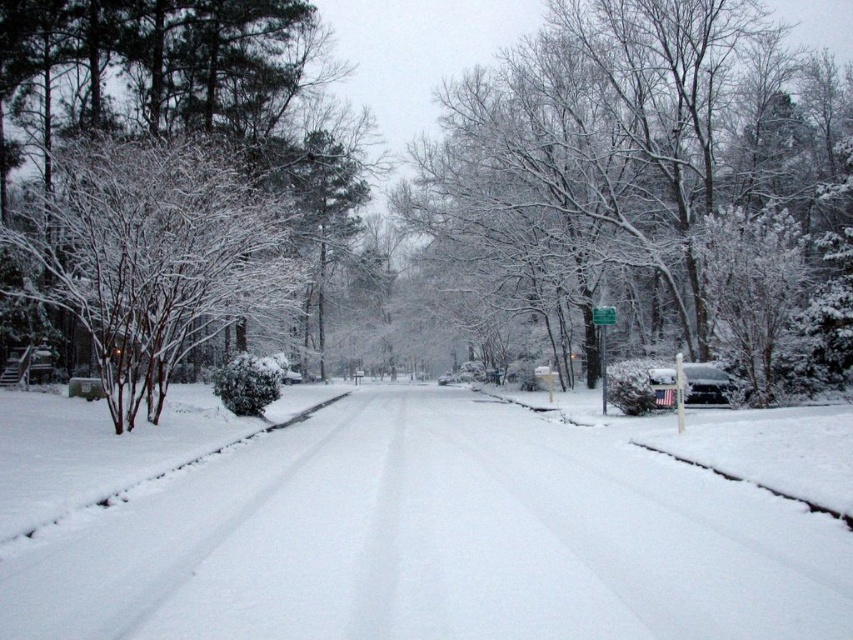
Looking at this image, you are standing on the residential street and want to walk from point A to point B. Point A is at coordinate point (619, 444) and point B is at coordinate point (613, 307). According to the image, which point is closer to you when you are facing the direction of the street?

Point A at coordinate point (619, 444) is closer to you because it is in front of point B at coordinate point (613, 307) when facing the street direction.

You are standing at the center of the snowy road and see a point marked at coordinates (631, 138). What object is located at that point?

The point at coordinates (631, 138) indicates a snow covered tree at center.